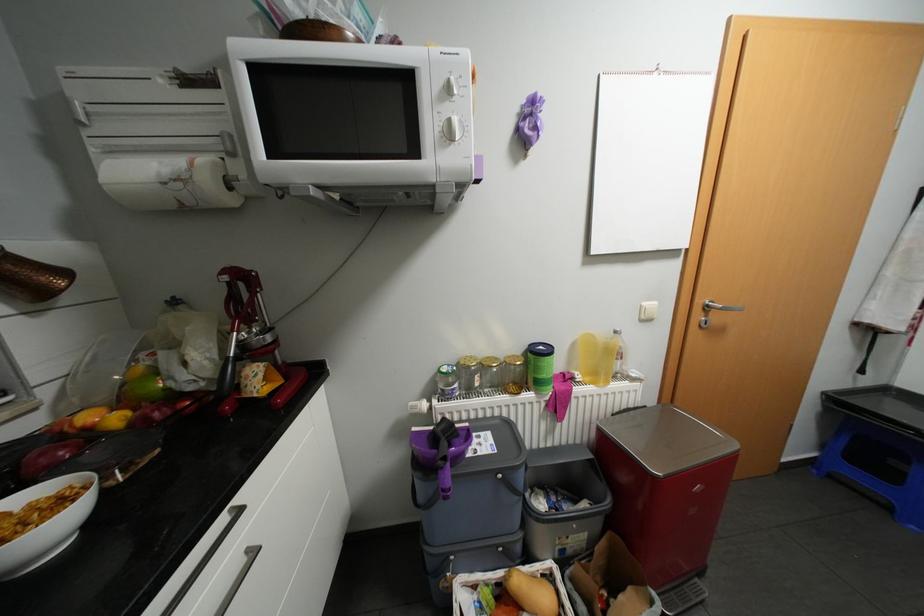
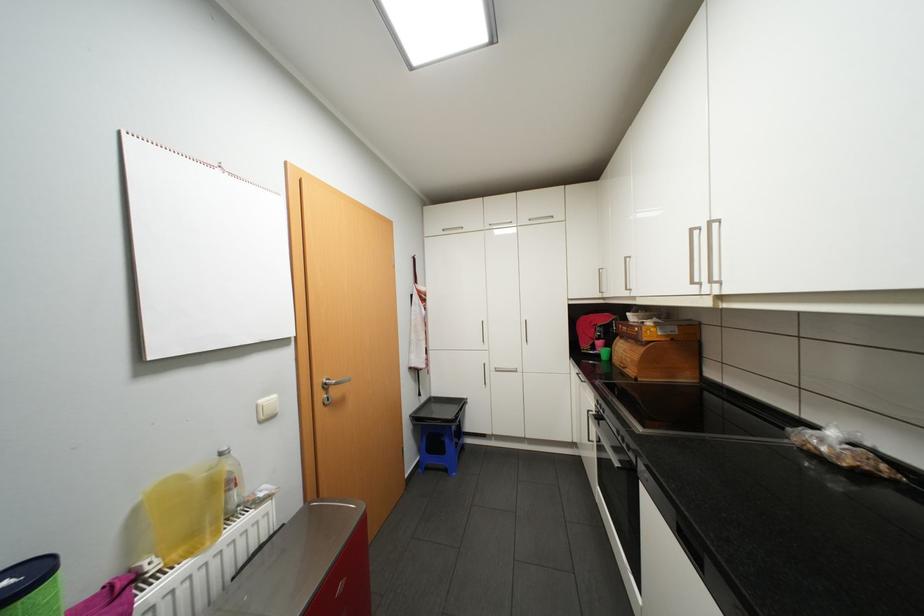
Question: The first image is from the beginning of the video and the second image is from the end. How did the camera likely rotate when shooting the video?

Choices:
 (A) Left
 (B) Right
 (C) Up
 (D) Down

Answer: (B)